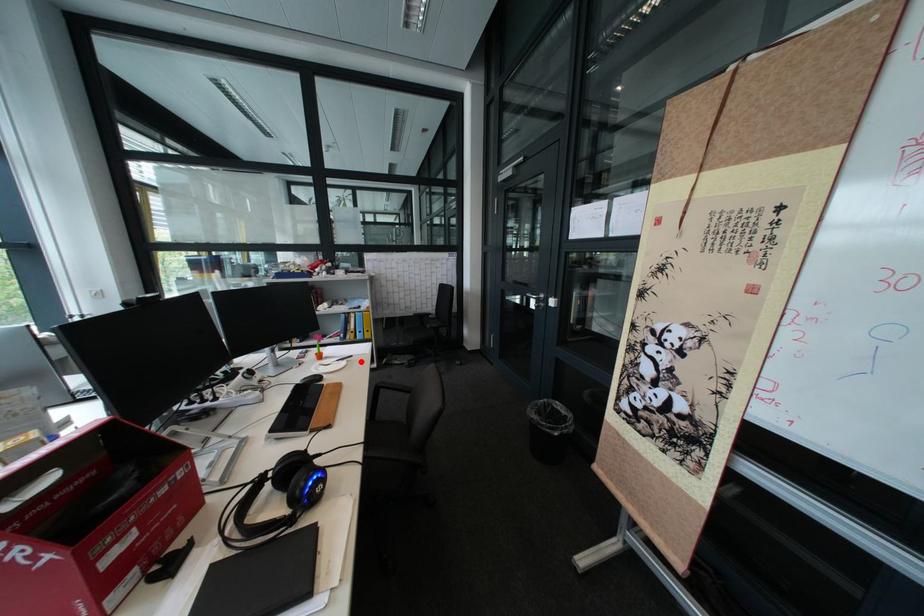
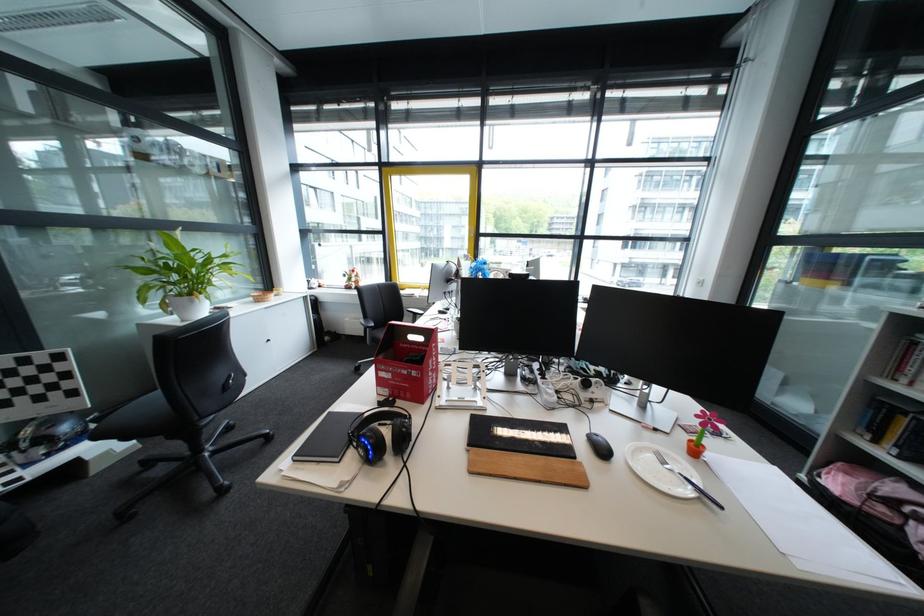
Where in the second image is the point corresponding to the highlighted location from the first image?

(712, 501)